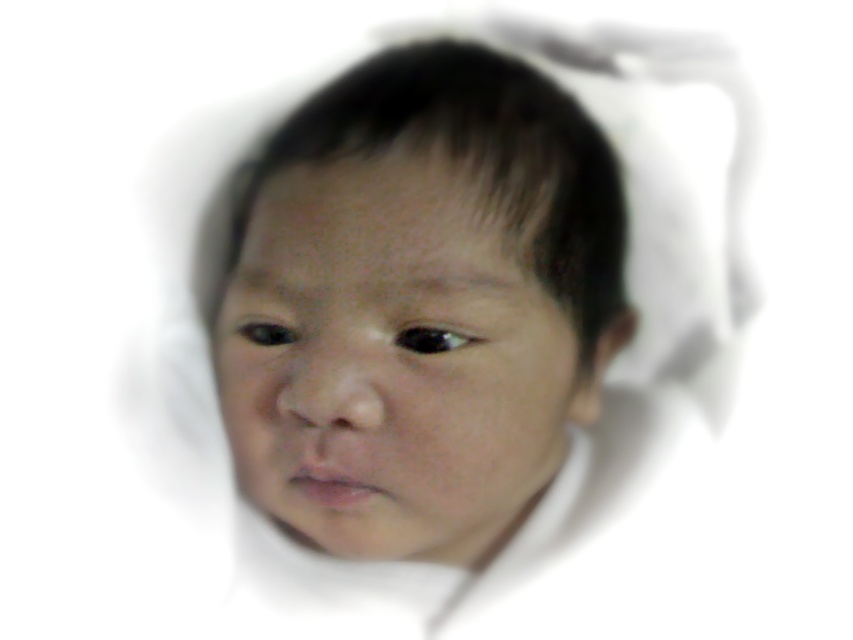
Question: Can you confirm if black glossy eye at center is wider than black eye at center?

Choices:
 (A) yes
 (B) no

Answer: (A)

Question: Among these points, which one is farthest from the camera?

Choices:
 (A) (541, 308)
 (B) (244, 321)

Answer: (B)

Question: Which of the following is the farthest from the observer?

Choices:
 (A) black glossy eye at center
 (B) smooth skin face at center

Answer: (A)

Question: Is black glossy eye at center positioned before black eye at center?

Choices:
 (A) no
 (B) yes

Answer: (B)

Question: Which point is farther to the camera?

Choices:
 (A) (430, 346)
 (B) (337, 259)

Answer: (B)

Question: Is black glossy eye at center smaller than black eye at center?

Choices:
 (A) no
 (B) yes

Answer: (B)